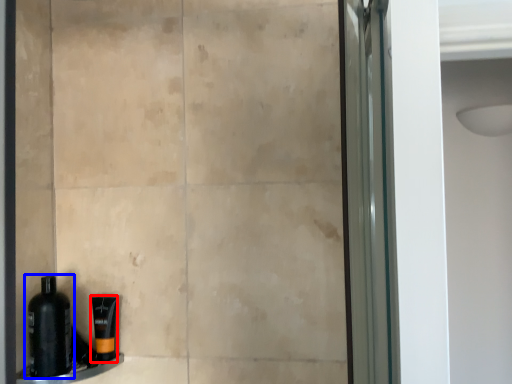
Question: Which object appears closest to the camera in this image, toiletry (highlighted by a red box) or bottle (highlighted by a blue box)?

Choices:
 (A) toiletry
 (B) bottle

Answer: (B)